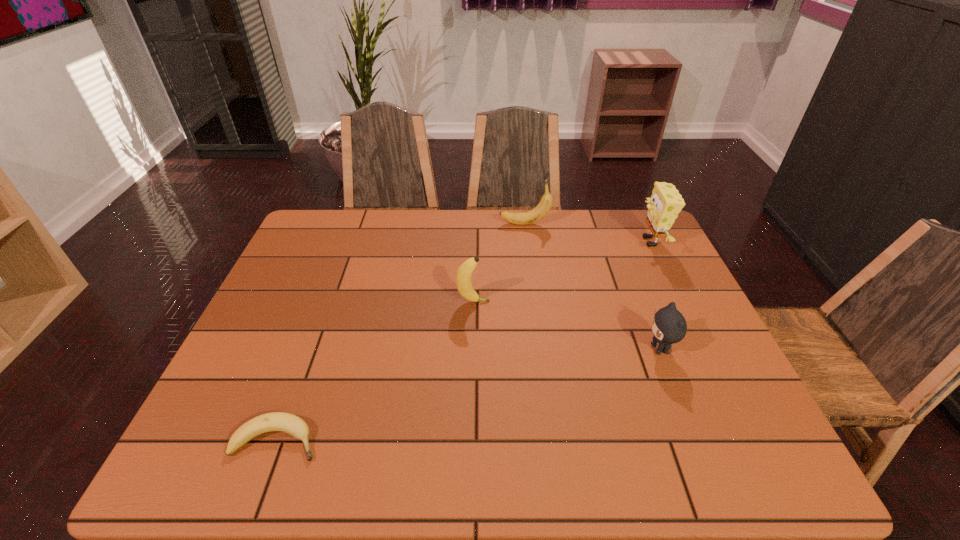
You are a GUI agent. You are given a task and a screenshot of the screen. Output one action in this format:
    pyautogui.click(x=<x>, y=<y>)
    Task: Click on the vacant region located on the face of the rightmost object
    Image resolution: width=960 pixels, height=540 pixels.
    Given the screenshot: What is the action you would take?
    pyautogui.click(x=525, y=241)

Locate an element on the screen. This screenshot has height=540, width=960. free region located 0.150m on the face of the rightmost object is located at coordinates (589, 241).

At what (x,y) coordinates should I click in order to perform the action: click on vacant space located at the start of the peel on the farthest banana. Please return your answer as a coordinate pair (x, y). Looking at the image, I should click on (475, 224).

The height and width of the screenshot is (540, 960). Find the location of `vacant space located 0.160m at the start of the peel on the farthest banana`. vacant space located 0.160m at the start of the peel on the farthest banana is located at coordinates (451, 224).

Find the location of `vacant space located 0.070m at the start of the peel on the farthest banana`. vacant space located 0.070m at the start of the peel on the farthest banana is located at coordinates (478, 224).

You are a GUI agent. You are given a task and a screenshot of the screen. Output one action in this format:
    pyautogui.click(x=<x>, y=<y>)
    Task: Click on the vacant space positioned 0.130m from the stem of the third farthest object
    The image size is (960, 540).
    Given the screenshot: What is the action you would take?
    pyautogui.click(x=538, y=302)

Where is `vacant space located on the front-facing side of the kitten`? The height and width of the screenshot is (540, 960). vacant space located on the front-facing side of the kitten is located at coordinates (579, 349).

What are the coordinates of `vacant space located on the front-facing side of the kitten` in the screenshot? It's located at (562, 349).

The image size is (960, 540). In order to click on vacant point located on the front-facing side of the kitten in this screenshot , I will do `click(512, 349)`.

Find the location of a particular element. free point located at the stem of the shortest object is located at coordinates (479, 440).